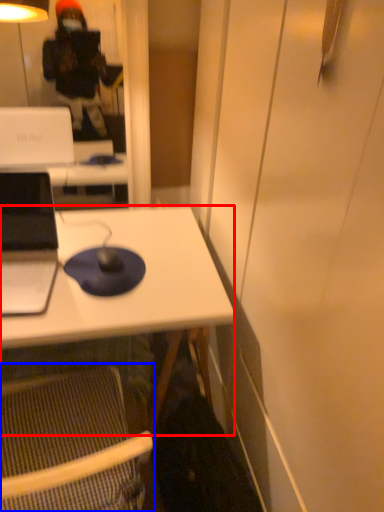
Question: Which point is further to the camera, desk (highlighted by a red box) or folding chair (highlighted by a blue box)?

Choices:
 (A) desk
 (B) folding chair

Answer: (A)